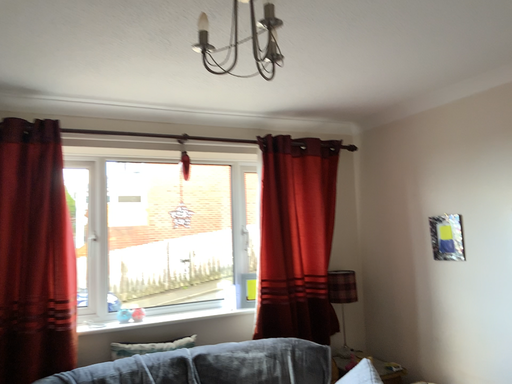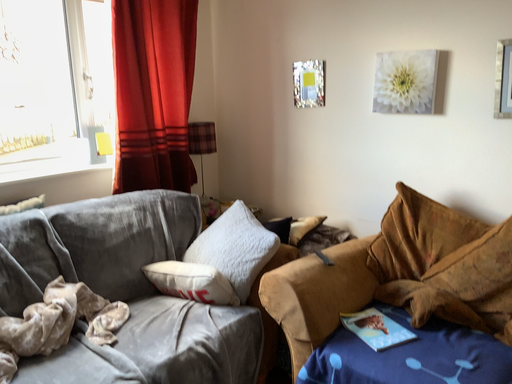
Question: Which way did the camera rotate in the video?

Choices:
 (A) rotated upward
 (B) rotated downward

Answer: (B)